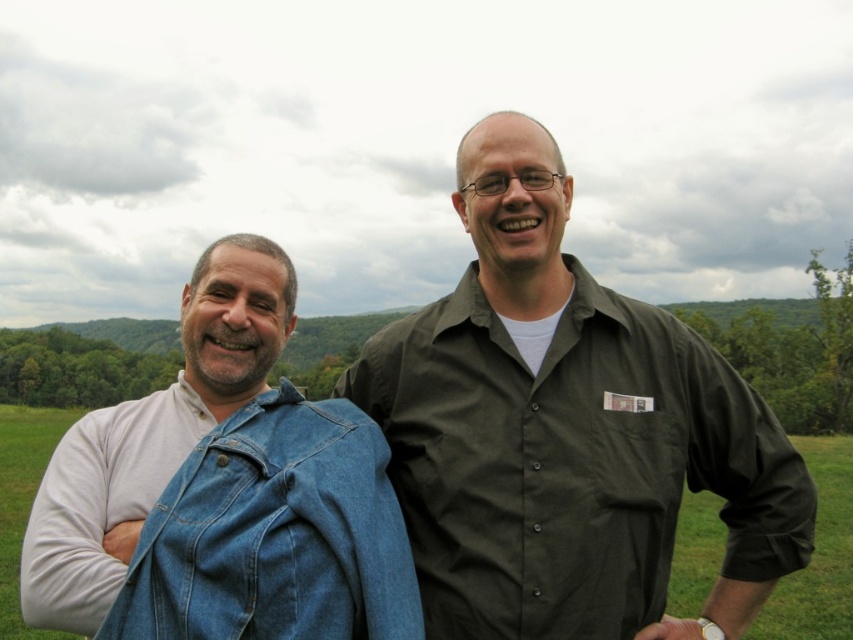
You are organizing a photo album and need to ensure all items in the image are labeled correctly. Given the scene described, which object takes up more area in the image between the matte green shirt at center and the faded denim jacket at lower right?

The faded denim jacket at lower right takes up more area in the image than the matte green shirt at center because the matte green shirt at center occupies less space than faded denim jacket at lower right.

You are a photographer setting up a shot of two people in a grassy field. You need to ensure the matte green shirt at center and the faded denim jacket at lower right are both visible. Which object should you adjust to avoid covering the other?

The faded denim jacket at lower right should be adjusted because the matte green shirt at center is positioned on the right side of it, so moving the denim jacket to the left would prevent it from blocking the shirt.

You are a photographer setting up a shoot in a grassy field. You notice the matte green shirt at center and the faded denim jacket at lower right. Which object should you adjust your camera focus to first if you want to capture both subjects clearly in the same frame?

The faded denim jacket at lower right should be focused on first because the matte green shirt at center is below it, meaning the jacket is closer to the camera. Adjusting focus starting from the closer object ensures both will be in focus when using depth of field properly.